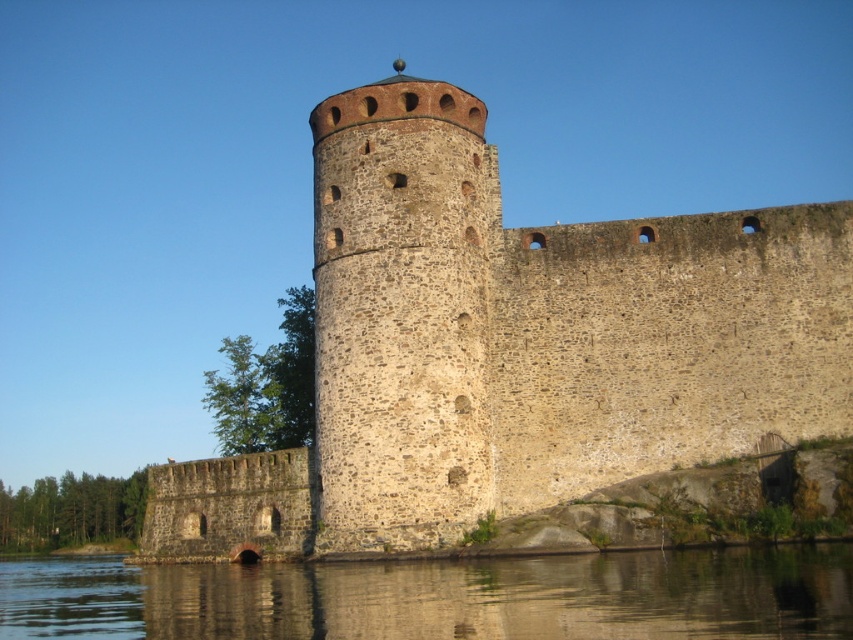
You are standing on the fortress wall and want to observe both the stone tower at center and the smooth water at lower center. Which object is closer to you?

The stone tower at center is closer to you because it is further to the viewer than the smooth water at lower center, meaning it appears nearer in the visual perspective.

You are standing at the point with coordinates 0.500, 0.500 in the image. You want to walk towards the stone wall at center. In which direction should you move?

You should move northeast to reach the stone wall at center located at point (511, 346) from your current position at (426, 320).

You are standing at the base of the historic stone fortress. You want to reach a specific point marked at coordinates point [506,362]. If your maximum comfortable walking distance is 200 feet, will you be able to reach that point comfortably?

The point [506,362] is 190.29 feet away from the viewer, which is within your maximum comfortable walking distance of 200 feet. Therefore, you can reach it comfortably.